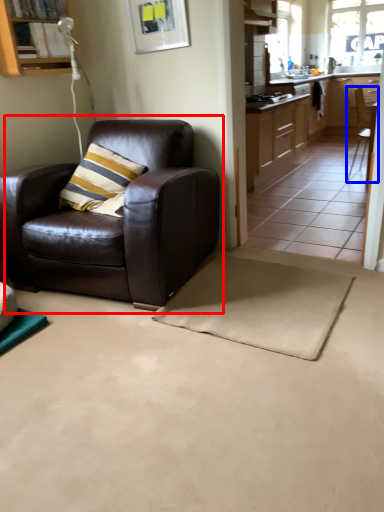
Question: Among these objects, which one is nearest to the camera, chair (highlighted by a red box) or chair (highlighted by a blue box)?

Choices:
 (A) chair
 (B) chair

Answer: (A)